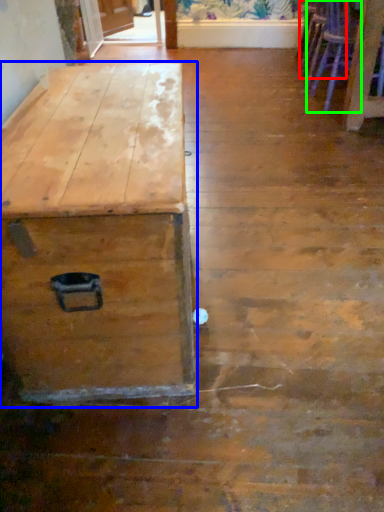
Question: Considering the real-world distances, which object is farthest from armchair (highlighted by a red box)? table (highlighted by a blue box) or armchair (highlighted by a green box)?

Choices:
 (A) table
 (B) armchair

Answer: (A)